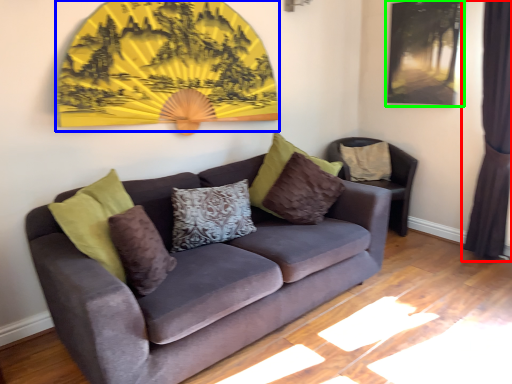
Question: Which object is the closest to the curtain (highlighted by a red box)? Choose among these: decor (highlighted by a blue box) or picture frame (highlighted by a green box).

Choices:
 (A) decor
 (B) picture frame

Answer: (B)